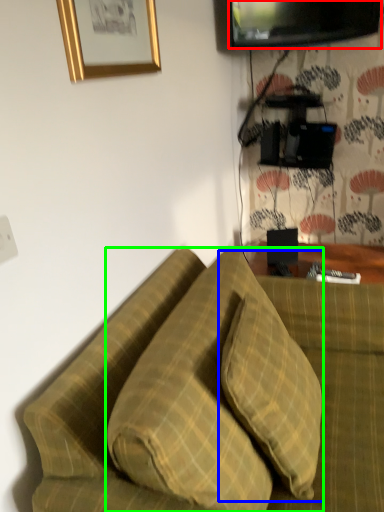
Question: Which is nearer to the television (highlighted by a red box)? pillow (highlighted by a blue box) or pillow (highlighted by a green box).

Choices:
 (A) pillow
 (B) pillow

Answer: (B)